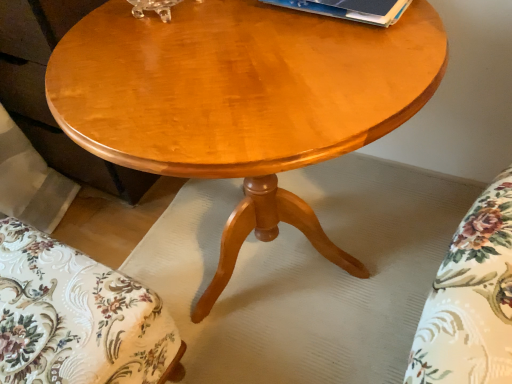
Question: Is floral fabric cushion at lower left not within blue paper at upper center?

Choices:
 (A) no
 (B) yes

Answer: (B)

Question: From a real-world perspective, does floral fabric cushion at lower left stand above blue paper at upper center?

Choices:
 (A) yes
 (B) no

Answer: (B)

Question: Is floral fabric cushion at lower left wider than blue paper at upper center?

Choices:
 (A) yes
 (B) no

Answer: (A)

Question: From a real-world perspective, does floral fabric cushion at lower left sit lower than blue paper at upper center?

Choices:
 (A) no
 (B) yes

Answer: (B)

Question: Is floral fabric cushion at lower left bigger than blue paper at upper center?

Choices:
 (A) no
 (B) yes

Answer: (B)

Question: Considering the positions of floral fabric cushion at lower left and blue paper at upper center in the image, is floral fabric cushion at lower left taller or shorter than blue paper at upper center?

Choices:
 (A) short
 (B) tall

Answer: (B)

Question: Based on their positions, is floral fabric cushion at lower left located to the left or right of blue paper at upper center?

Choices:
 (A) right
 (B) left

Answer: (B)

Question: Is floral fabric cushion at lower left in front of or behind blue paper at upper center in the image?

Choices:
 (A) front
 (B) behind

Answer: (A)

Question: Considering the positions of floral fabric cushion at lower left and blue paper at upper center in the image, is floral fabric cushion at lower left wider or thinner than blue paper at upper center?

Choices:
 (A) thin
 (B) wide

Answer: (B)

Question: Is blue paper at upper center in front of or behind glossy wood coffee table at center in the image?

Choices:
 (A) front
 (B) behind

Answer: (B)

Question: Looking at the image, does blue paper at upper center seem bigger or smaller compared to glossy wood coffee table at center?

Choices:
 (A) small
 (B) big

Answer: (A)

Question: From a real-world perspective, is blue paper at upper center above or below glossy wood coffee table at center?

Choices:
 (A) above
 (B) below

Answer: (A)

Question: Is point (380, 4) closer or farther from the camera than point (342, 87)?

Choices:
 (A) closer
 (B) farther

Answer: (B)

Question: In terms of height, does blue paper at upper center look taller or shorter compared to floral fabric cushion at lower left?

Choices:
 (A) tall
 (B) short

Answer: (B)

Question: Is blue paper at upper center inside or outside of floral fabric cushion at lower left?

Choices:
 (A) inside
 (B) outside

Answer: (B)